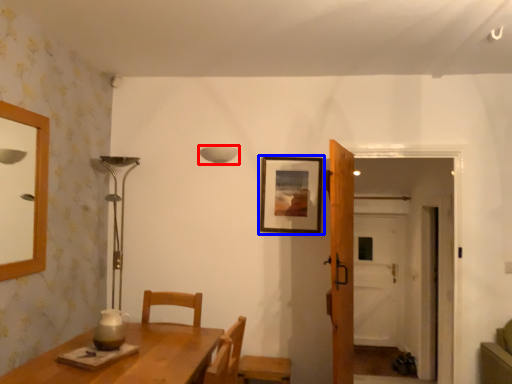
Question: Which of the following is the farthest to the observer, lamp (highlighted by a red box) or picture frame (highlighted by a blue box)?

Choices:
 (A) lamp
 (B) picture frame

Answer: (A)